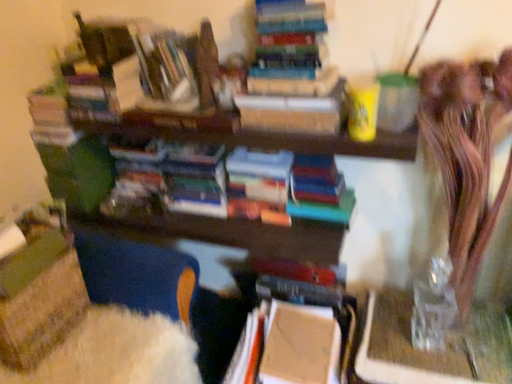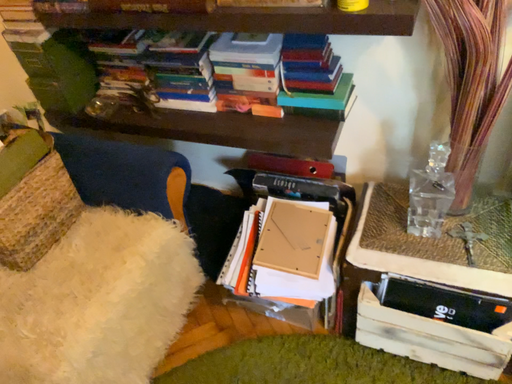
Question: Which way did the camera rotate in the video?

Choices:
 (A) rotated upward
 (B) rotated downward

Answer: (B)